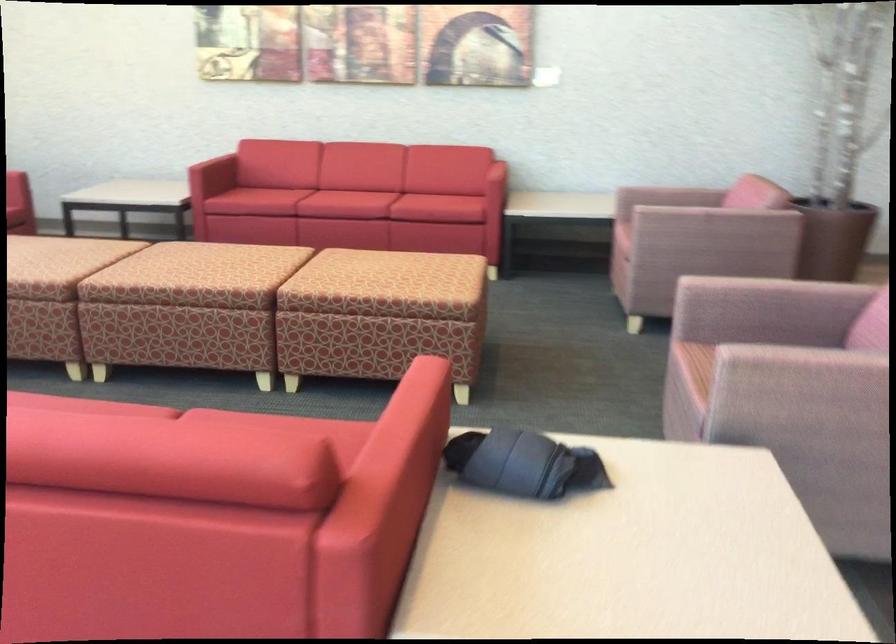
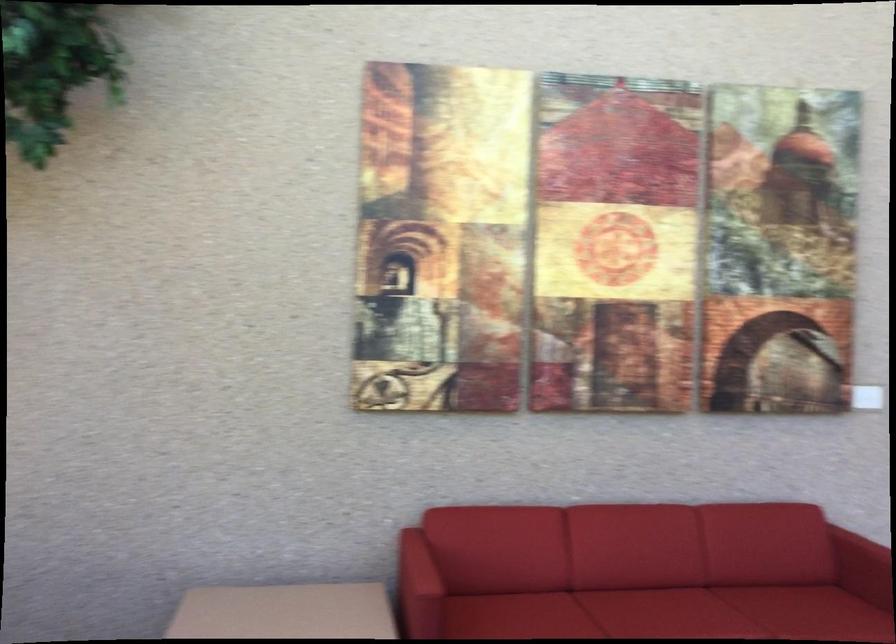
Where in the second image is the point corresponding to (x=209, y=138) from the first image?

(418, 564)